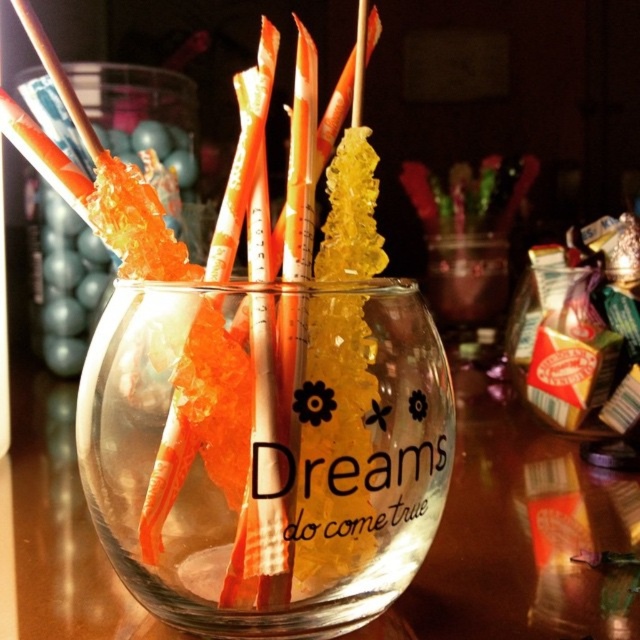
Question: Which point is closer to the camera?

Choices:
 (A) (248, 168)
 (B) (200, 429)

Answer: (B)

Question: Among these points, which one is farthest from the camera?

Choices:
 (A) (118, 330)
 (B) (268, 22)

Answer: (B)

Question: Is transparent glass vase at center further to camera compared to translucent paper straw at center?

Choices:
 (A) yes
 (B) no

Answer: (B)

Question: Is transparent glass vase at center to the right of translucent paper straw at center from the viewer's perspective?

Choices:
 (A) yes
 (B) no

Answer: (A)

Question: From the image, what is the correct spatial relationship of transparent glass vase at center in relation to translucent paper straw at center?

Choices:
 (A) right
 (B) left

Answer: (A)

Question: Which point appears closest to the camera in this image?

Choices:
 (A) (412, 310)
 (B) (273, 36)

Answer: (A)